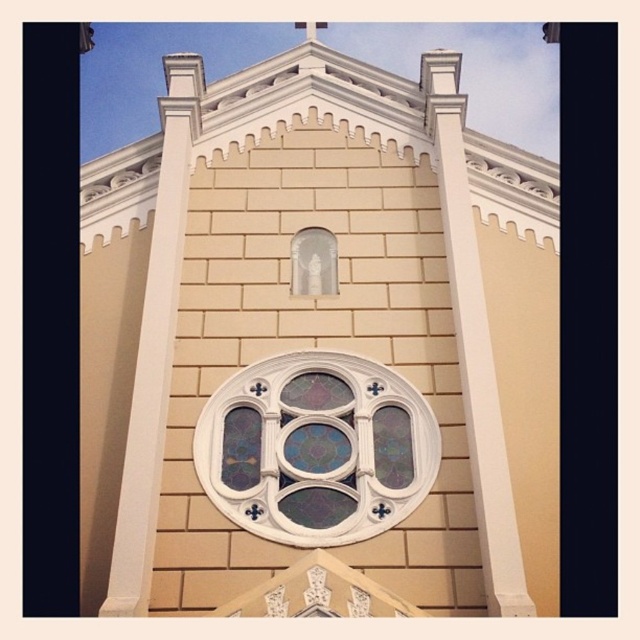
You are an architect designing a new church and want to ensure proper lighting. Given the stained glass window at center and the translucent glass statue at center, which object allows more light to pass through based on their sizes?

The stained glass window at center has a larger size compared to the translucent glass statue at center, so it allows more light to pass through.